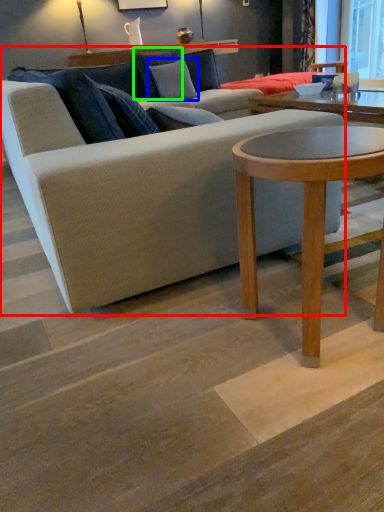
Question: Based on their relative distances, which object is nearer to studio couch (highlighted by a red box)? Choose from pillow (highlighted by a blue box) and pillow (highlighted by a green box).

Choices:
 (A) pillow
 (B) pillow

Answer: (A)